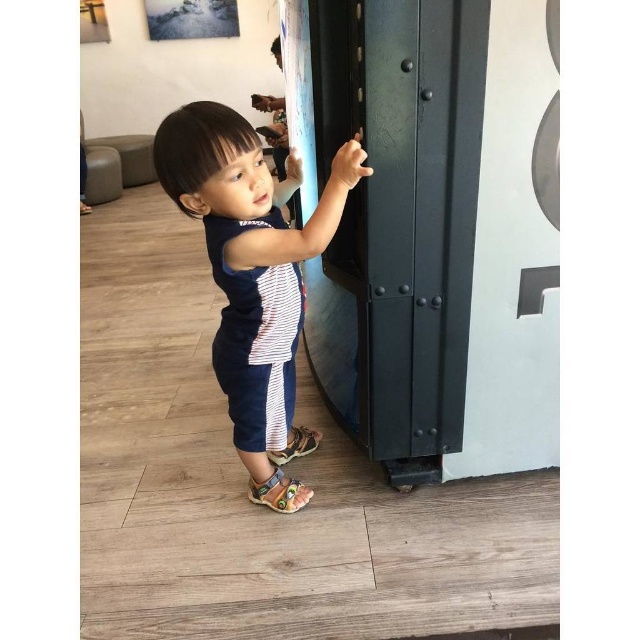
Question: Which point is farther to the camera?

Choices:
 (A) (296, 483)
 (B) (273, 212)
 (C) (317, 440)
 (D) (262, 221)

Answer: (C)

Question: Is blue striped shirt at center thinner than brown leather sandal at lower center?

Choices:
 (A) no
 (B) yes

Answer: (A)

Question: Does blue striped shirt at center appear under brown leather sandal at lower center?

Choices:
 (A) no
 (B) yes

Answer: (A)

Question: Which is nearer to the multicolored leather sandal at lower center?

Choices:
 (A) white striped shirt at center
 (B) blue striped shirt at center

Answer: (A)

Question: Which point appears closest to the camera in this image?

Choices:
 (A) (300, 426)
 (B) (237, 440)
 (C) (289, 496)
 (D) (182, 182)

Answer: (D)

Question: Can you confirm if blue striped shirt at center is positioned below white striped shirt at center?

Choices:
 (A) no
 (B) yes

Answer: (A)